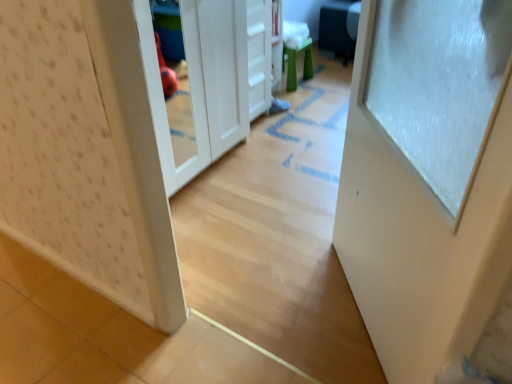
Question: Is white matte drawer at center bigger or smaller than green rubber stool at center?

Choices:
 (A) big
 (B) small

Answer: (A)

Question: In terms of height, does white matte drawer at center look taller or shorter compared to green rubber stool at center?

Choices:
 (A) tall
 (B) short

Answer: (A)

Question: Which of these objects is positioned farthest from the white glossy door at right?

Choices:
 (A) green rubber stool at center
 (B) white matte drawer at center

Answer: (A)

Question: Estimate the real-world distances between objects in this image. Which object is farther from the green rubber stool at center?

Choices:
 (A) white glossy door at right
 (B) white matte drawer at center

Answer: (A)